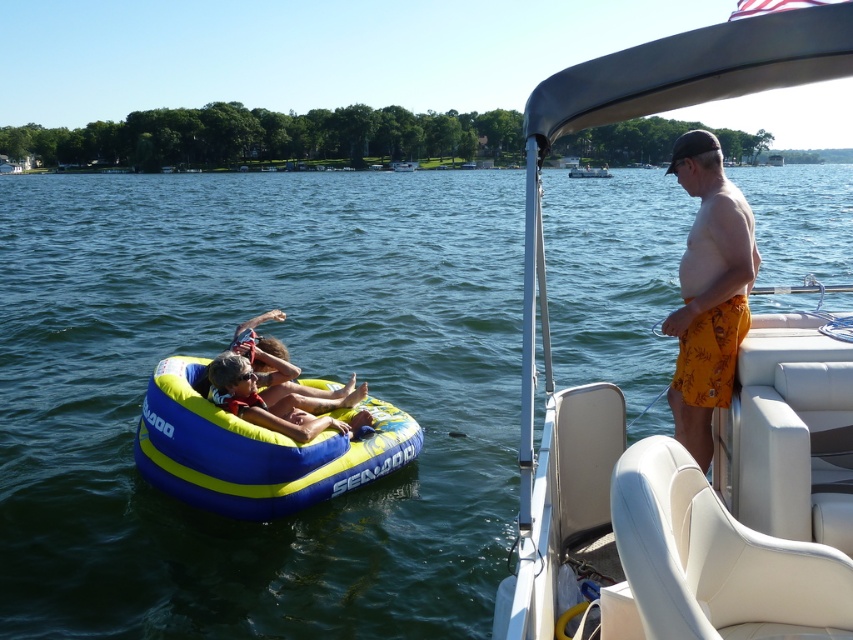
Question: Which object is positioned closest to the blue inflatable tube at center?

Choices:
 (A) yellow/blue fabric life jacket at lower left
 (B) white plastic boat at upper center
 (C) blue inflatable ring at lower left

Answer: (C)

Question: Does orange floral shorts at right have a greater width compared to yellow/blue fabric life jacket at lower left?

Choices:
 (A) yes
 (B) no

Answer: (A)

Question: Where is blue inflatable ring at lower left located in relation to yellow/blue fabric life jacket at lower left in the image?

Choices:
 (A) right
 (B) left

Answer: (A)

Question: From the image, what is the correct spatial relationship of blue inflatable ring at lower left in relation to yellow fabric float at center?

Choices:
 (A) right
 (B) left

Answer: (B)

Question: Which point is farther from the camera taking this photo?

Choices:
 (A) (262, 477)
 (B) (675, 417)
 (C) (804, 499)
 (D) (364, 609)

Answer: (A)

Question: Considering the real-world distances, which object is closest to the yellow fabric float at center?

Choices:
 (A) blue inflatable tube at center
 (B) blue inflatable ring at lower left
 (C) orange floral shorts at right

Answer: (B)